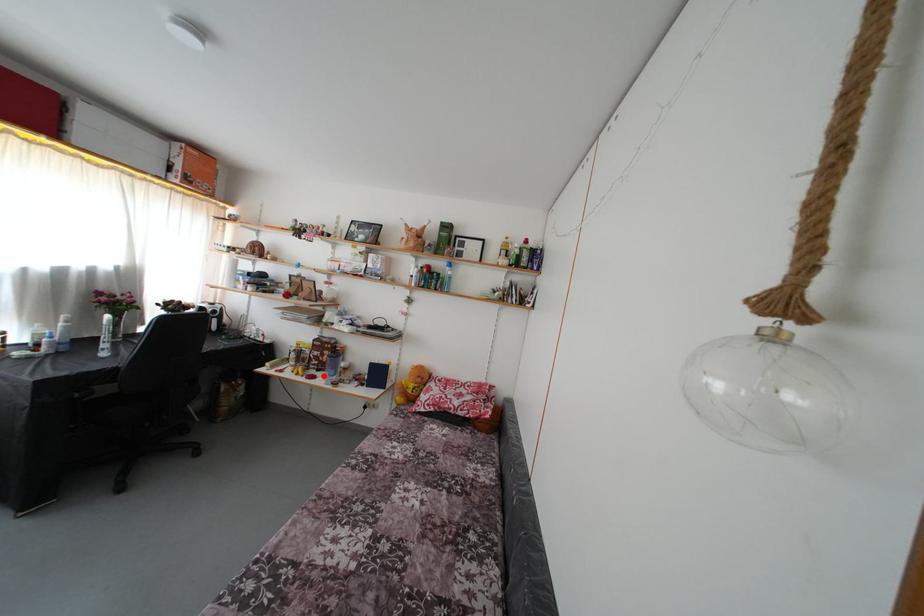
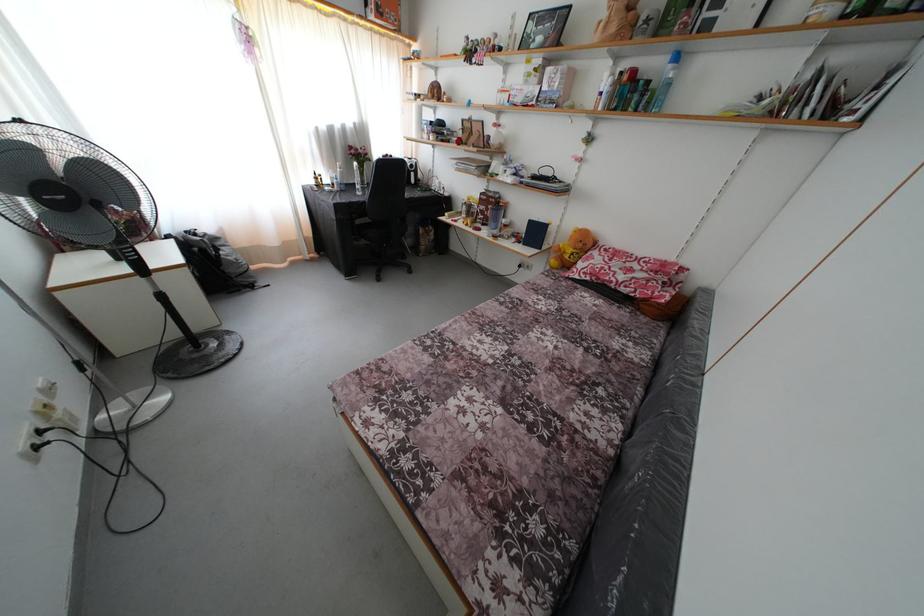
Question: I am providing you with two images of the same scene from different viewpoints. A red point is shown in image1. For the corresponding object point in image2, is it positioned nearer or farther from the camera?

Choices:
 (A) Nearer
 (B) Farther

Answer: (A)